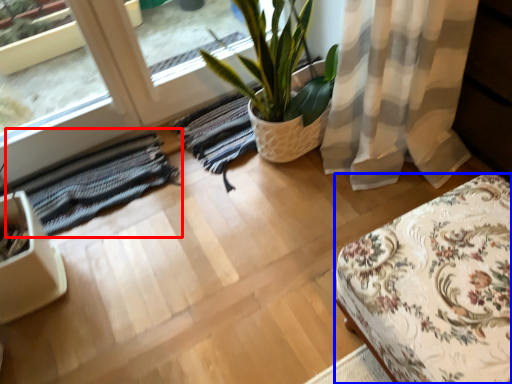
Question: Among these objects, which one is farthest to the camera, mat (highlighted by a red box) or furniture (highlighted by a blue box)?

Choices:
 (A) mat
 (B) furniture

Answer: (A)